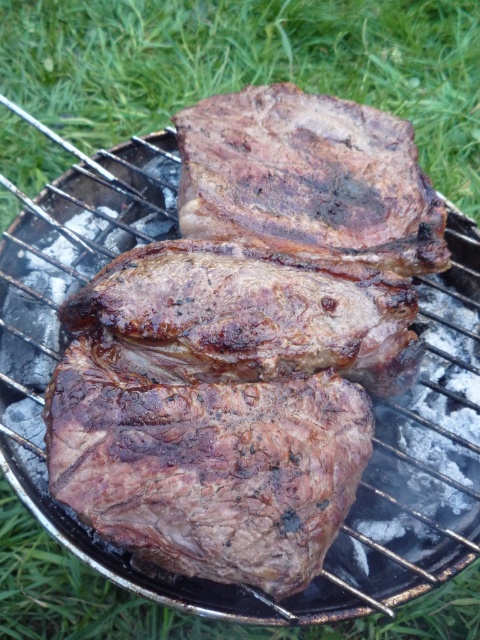
Is green grass at upper center behind charred seared steak at center?

Yes, green grass at upper center is behind charred seared steak at center.

Can you confirm if green grass at upper center is positioned to the left of charred seared steak at center?

Correct, you'll find green grass at upper center to the left of charred seared steak at center.

The image size is (480, 640). What do you see at coordinates (249, 65) in the screenshot?
I see `green grass at upper center` at bounding box center [249, 65].

Where is `green grass at upper center`? The image size is (480, 640). green grass at upper center is located at coordinates (249, 65).